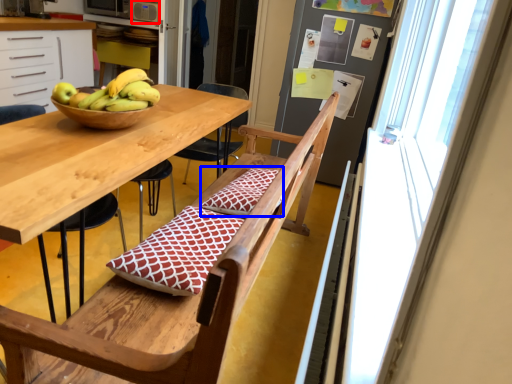
Question: Which of the following is the farthest to the observer, appliance (highlighted by a red box) or pillow (highlighted by a blue box)?

Choices:
 (A) appliance
 (B) pillow

Answer: (A)